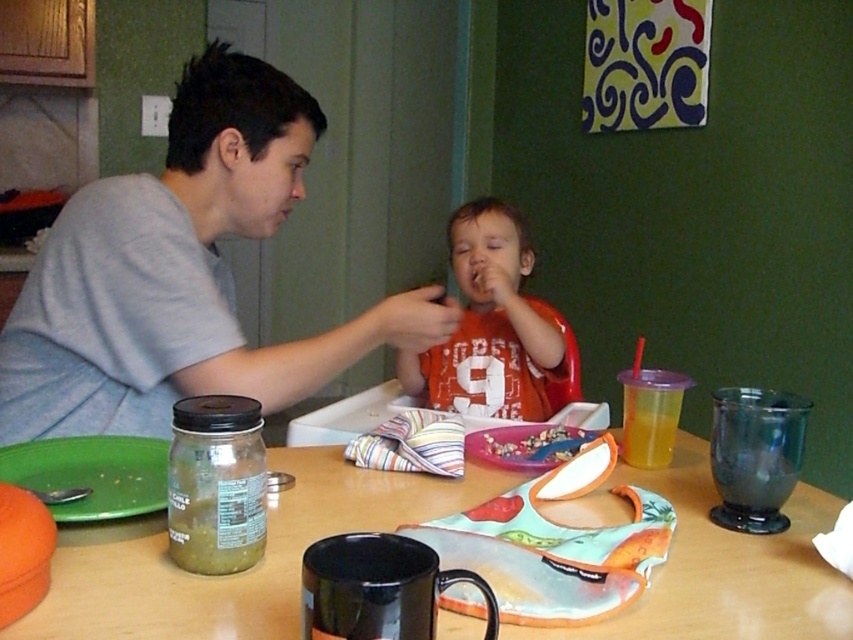
Who is positioned more to the left, gray matte shirt at upper left or purple plastic tray at center?

Positioned to the left is gray matte shirt at upper left.

Between gray matte shirt at upper left and purple plastic tray at center, which one appears on the right side from the viewer's perspective?

Positioned to the right is purple plastic tray at center.

Is point (67, 355) less distant than point (538, 461)?

That is False.

The height and width of the screenshot is (640, 853). Identify the location of gray matte shirt at upper left. pyautogui.click(x=183, y=273).

Is wooden table at center in front of crumbly brown cereal at center?

Yes, wooden table at center is in front of crumbly brown cereal at center.

Does wooden table at center have a smaller size compared to crumbly brown cereal at center?

Actually, wooden table at center might be larger than crumbly brown cereal at center.

This screenshot has width=853, height=640. Describe the element at coordinates (241, 572) in the screenshot. I see `wooden table at center` at that location.

Locate an element on the screen. wooden table at center is located at coordinates (241, 572).

Does gray matte shirt at upper left have a lesser height compared to green plastic plate at lower left?

No, gray matte shirt at upper left is not shorter than green plastic plate at lower left.

Who is taller, gray matte shirt at upper left or green plastic plate at lower left?

gray matte shirt at upper left

Is point (76, 266) behind point (55, 456)?

Yes.

The height and width of the screenshot is (640, 853). Identify the location of gray matte shirt at upper left. (183, 273).